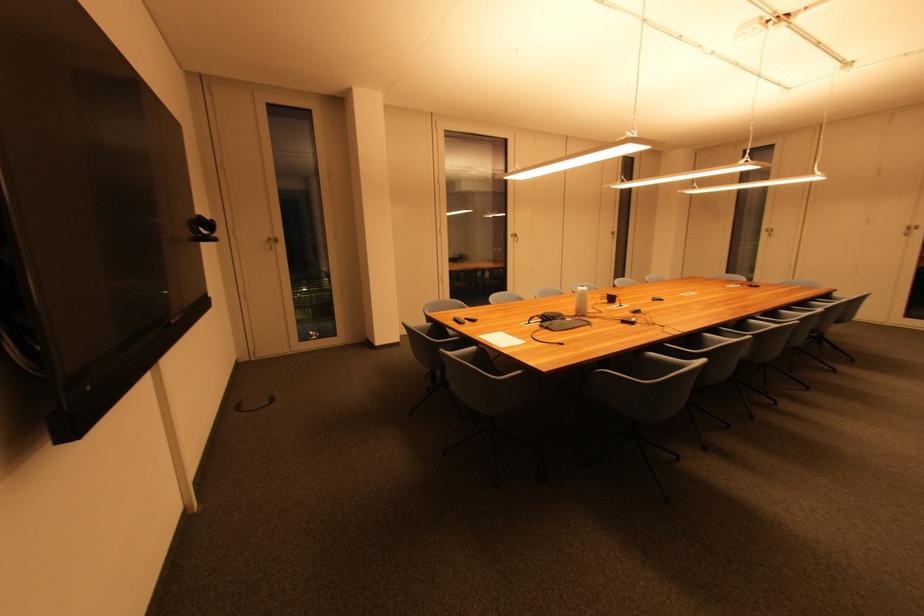
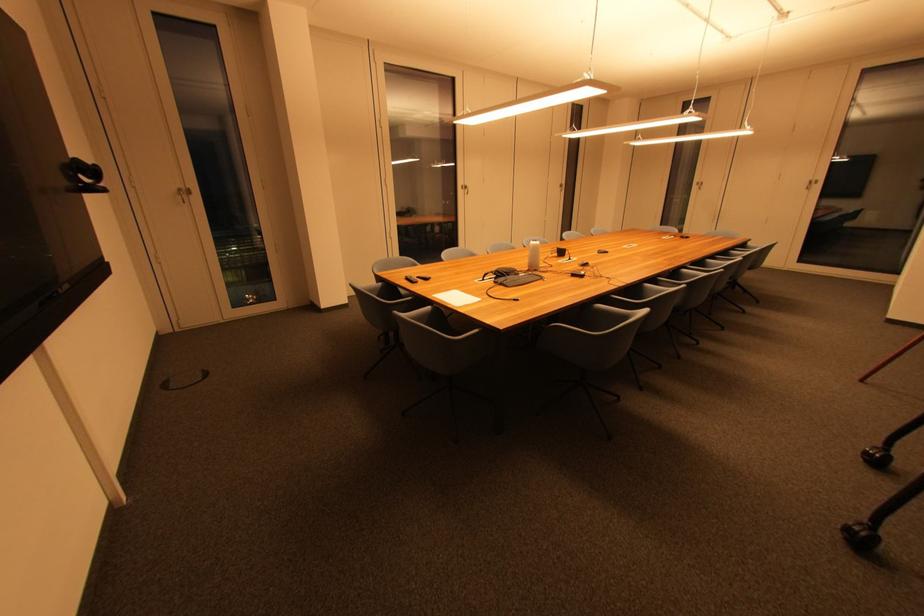
Where in the second image is the point corresponding to pixel 517 238 from the first image?

(468, 190)